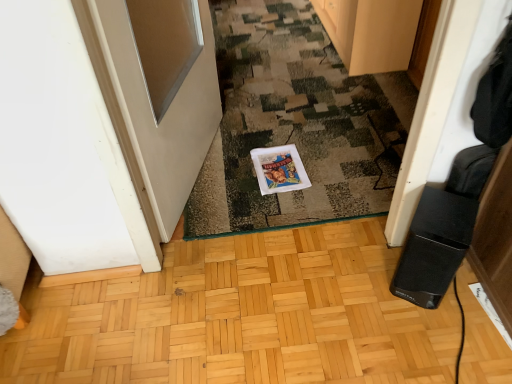
Find the location of a particular element. The height and width of the screenshot is (384, 512). free space in front of wooden cabinet at upper center is located at coordinates (333, 91).